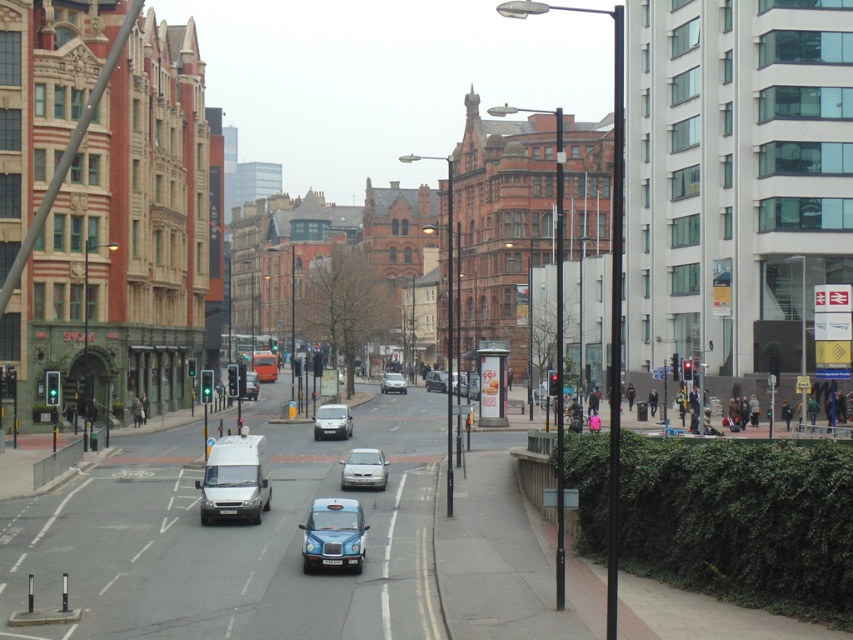
Is white matte van at center taller than metallic silver car at center?

Yes, white matte van at center is taller than metallic silver car at center.

Who is more forward, (228,484) or (445,380)?

Point (228,484) is in front.

You are a GUI agent. You are given a task and a screenshot of the screen. Output one action in this format:
    pyautogui.click(x=<x>, y=<y>)
    Task: Click on the white matte van at center
    The width and height of the screenshot is (853, 640).
    Given the screenshot: What is the action you would take?
    pyautogui.click(x=235, y=480)

Who is shorter, satin silver sedan at center or matte silver car at center?

With less height is satin silver sedan at center.

Which is in front, point (373, 456) or point (331, 408)?

Point (373, 456)

Which is behind, point (351, 458) or point (321, 428)?

The point (321, 428) is behind.

The height and width of the screenshot is (640, 853). Find the location of `satin silver sedan at center`. satin silver sedan at center is located at coordinates pyautogui.click(x=364, y=468).

From the picture: Can you confirm if silver metallic sedan at center is taller than metallic silver car at center?

Incorrect, silver metallic sedan at center's height is not larger of metallic silver car at center's.

Who is lower down, silver metallic sedan at center or metallic silver car at center?

metallic silver car at center

Between point (381, 388) and point (436, 372), which one is positioned behind?

The point (436, 372) is more distant.

Locate an element on the screen. Image resolution: width=853 pixels, height=640 pixels. silver metallic sedan at center is located at coordinates (393, 381).